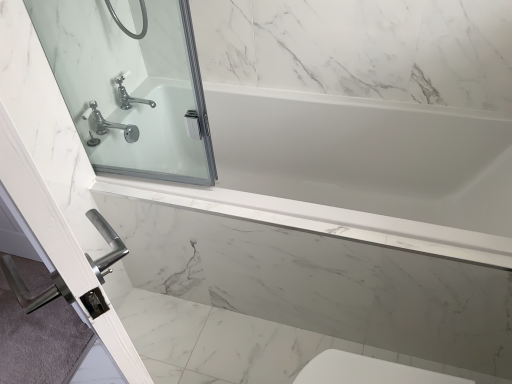
Question: Does clear glass shower door at upper left have a lesser width compared to clear glass door at upper left?

Choices:
 (A) yes
 (B) no

Answer: (A)

Question: Is clear glass shower door at upper left oriented away from clear glass door at upper left?

Choices:
 (A) yes
 (B) no

Answer: (B)

Question: Is there a large distance between clear glass shower door at upper left and clear glass door at upper left?

Choices:
 (A) yes
 (B) no

Answer: (B)

Question: From a real-world perspective, is clear glass shower door at upper left positioned under clear glass door at upper left based on gravity?

Choices:
 (A) yes
 (B) no

Answer: (B)

Question: Is clear glass shower door at upper left closer to camera compared to clear glass door at upper left?

Choices:
 (A) no
 (B) yes

Answer: (A)

Question: Based on their sizes in the image, would you say white glossy bathtub at center is bigger or smaller than clear glass shower door at upper left?

Choices:
 (A) small
 (B) big

Answer: (B)

Question: From the image's perspective, is white glossy bathtub at center located above or below clear glass shower door at upper left?

Choices:
 (A) above
 (B) below

Answer: (B)

Question: Does point (307, 188) appear closer or farther from the camera than point (125, 66)?

Choices:
 (A) closer
 (B) farther

Answer: (B)

Question: Relative to clear glass shower door at upper left, is white glossy bathtub at center in front or behind?

Choices:
 (A) behind
 (B) front

Answer: (A)

Question: Is point (96, 115) closer or farther from the camera than point (92, 246)?

Choices:
 (A) farther
 (B) closer

Answer: (A)

Question: Is chrome metallic faucet at upper left situated inside clear glass door at upper left or outside?

Choices:
 (A) outside
 (B) inside

Answer: (A)

Question: From a real-world perspective, is chrome metallic faucet at upper left physically located above or below clear glass door at upper left?

Choices:
 (A) below
 (B) above

Answer: (A)

Question: In the image, is chrome metallic faucet at upper left positioned in front of or behind clear glass door at upper left?

Choices:
 (A) behind
 (B) front

Answer: (A)

Question: Does point (272, 162) appear closer or farther from the camera than point (15, 51)?

Choices:
 (A) closer
 (B) farther

Answer: (B)

Question: Is white glossy bathtub at center to the left or to the right of clear glass door at upper left in the image?

Choices:
 (A) left
 (B) right

Answer: (B)